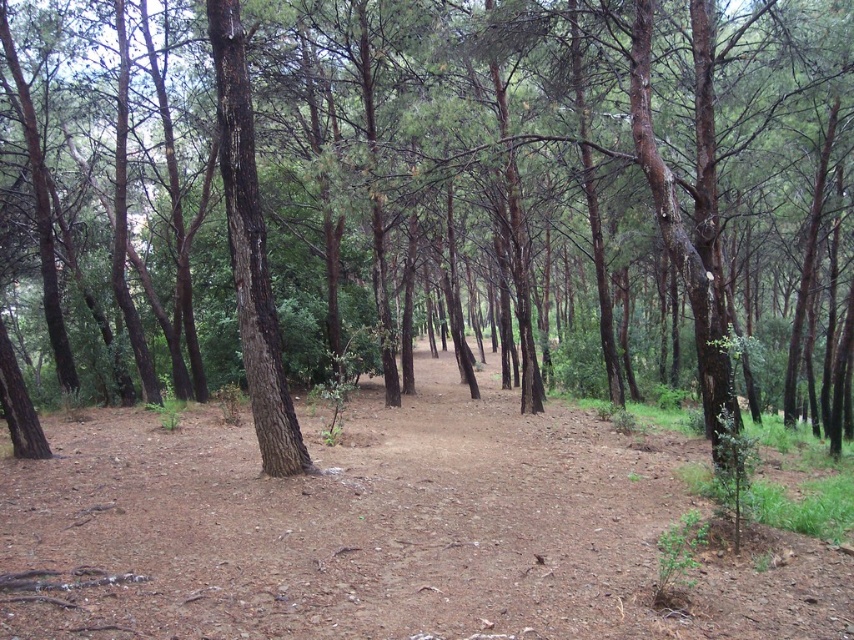
Question: Can you confirm if brown dirt track at center is positioned above dark brown bark tree at center?

Choices:
 (A) yes
 (B) no

Answer: (B)

Question: Is brown dirt track at center to the right of dark brown bark tree at center from the viewer's perspective?

Choices:
 (A) yes
 (B) no

Answer: (A)

Question: Which of the following is the farthest from the observer?

Choices:
 (A) dark brown bark tree at center
 (B) brown dirt track at center

Answer: (A)

Question: Considering the relative positions of brown dirt track at center and dark brown bark tree at center in the image provided, where is brown dirt track at center located with respect to dark brown bark tree at center?

Choices:
 (A) above
 (B) below

Answer: (B)

Question: Among these objects, which one is nearest to the camera?

Choices:
 (A) dark brown bark tree at center
 (B) brown dirt track at center

Answer: (B)

Question: Which of the following is the closest to the observer?

Choices:
 (A) dark brown bark tree at center
 (B) brown dirt track at center

Answer: (B)